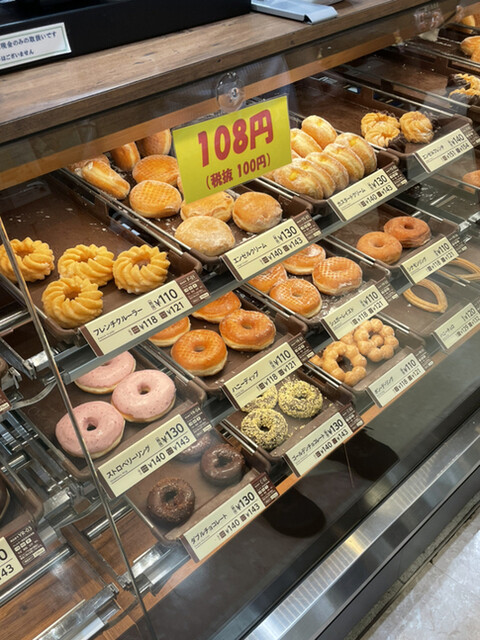
The height and width of the screenshot is (640, 480). What are the coordinates of `brown wood floor below` in the screenshot? It's located at (43, 600), (207, 585).